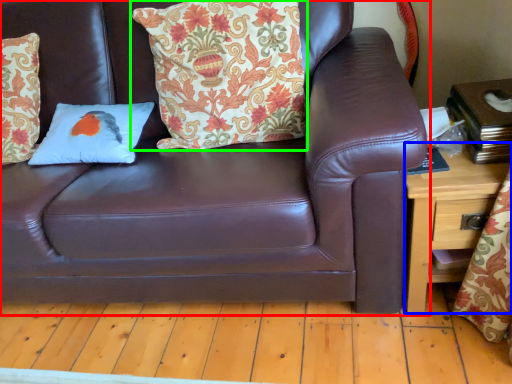
Question: Which object is the farthest from studio couch (highlighted by a red box)? Choose among these: table (highlighted by a blue box) or pillow (highlighted by a green box).

Choices:
 (A) table
 (B) pillow

Answer: (A)